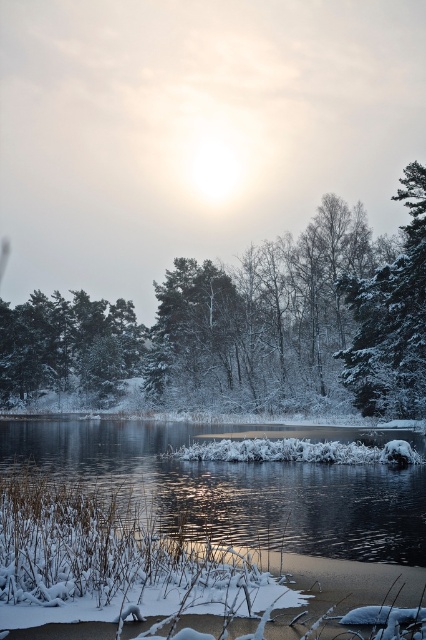
From the picture: You are standing at the edge of the lake and see two points in the scene. The first point is labeled as point (391, 547), and the second is point (46, 300). Which point is closer to you?

Point (391, 547) is in front of point (46, 300), so it is closer to you.